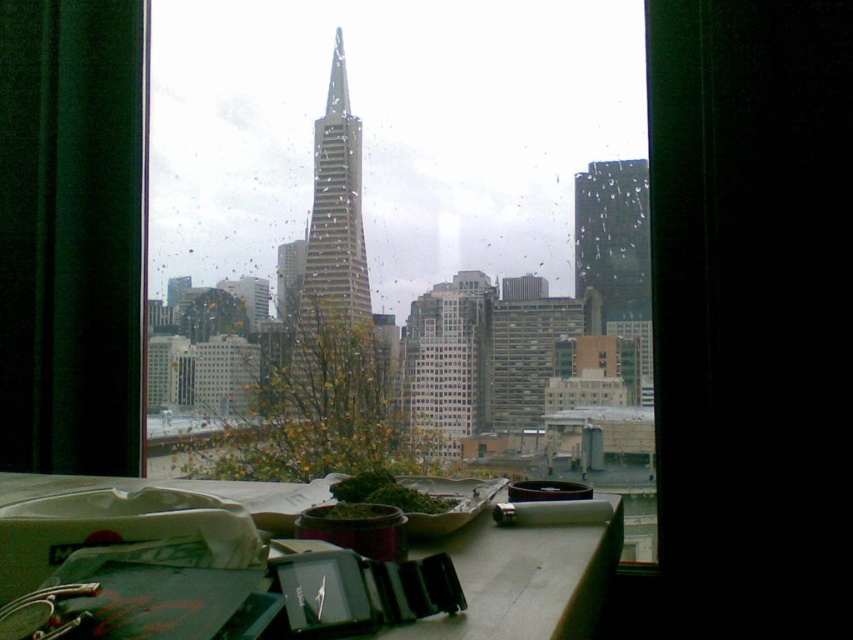
Question: Which of the following is the farthest from the observer?

Choices:
 (A) (637, 268)
 (B) (349, 410)
 (C) (308, 108)

Answer: (C)

Question: Which point is farther from the camera taking this photo?

Choices:
 (A) (618, 141)
 (B) (595, 192)

Answer: (A)

Question: Which of these objects is positioned closest to the glassy steel skyscraper at center?

Choices:
 (A) transparent glass window at center
 (B) glassy reflective skyscraper at right

Answer: (A)

Question: Is glassy steel skyscraper at center thinner than glassy reflective skyscraper at right?

Choices:
 (A) yes
 (B) no

Answer: (B)

Question: Can you confirm if transparent glass window at center is wider than glassy reflective skyscraper at right?

Choices:
 (A) yes
 (B) no

Answer: (A)

Question: Is transparent glass window at center in front of glassy reflective skyscraper at right?

Choices:
 (A) yes
 (B) no

Answer: (A)